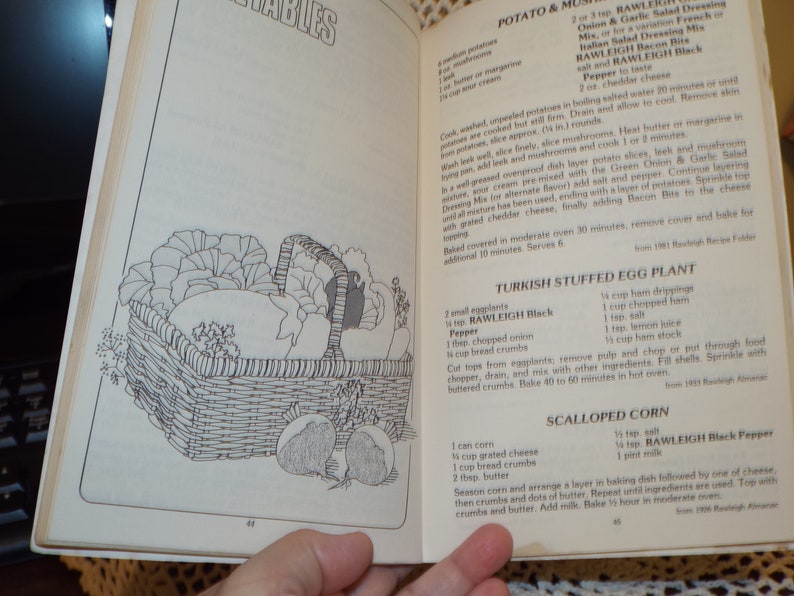
Image resolution: width=794 pixels, height=596 pixels. I want to click on book, so click(391, 167).